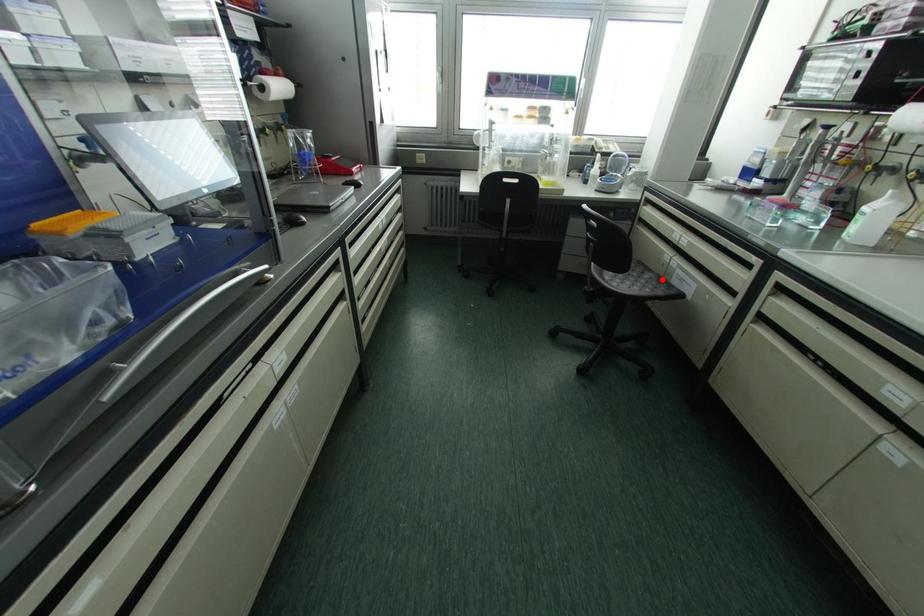
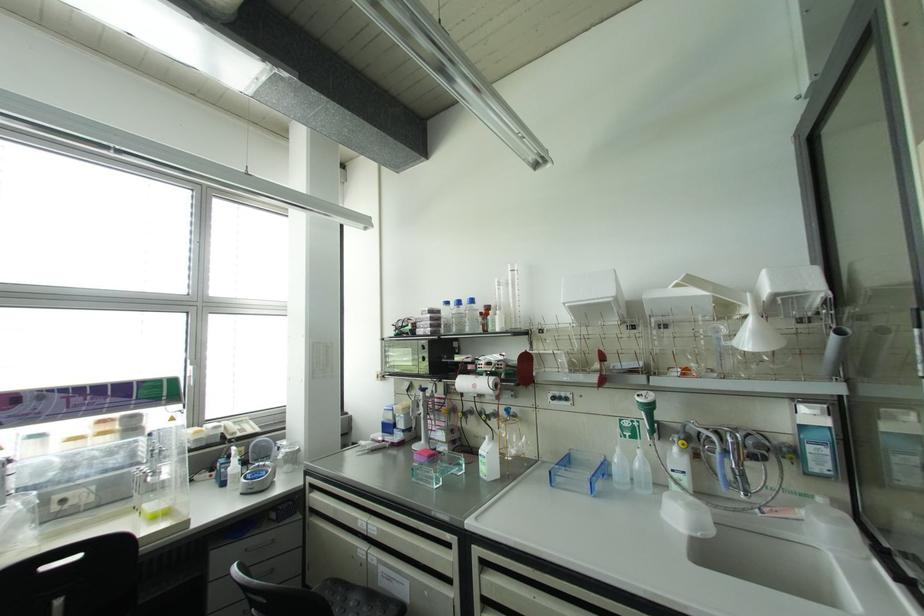
The point at the highlighted location is marked in the first image. Where is the corresponding point in the second image?

(371, 596)